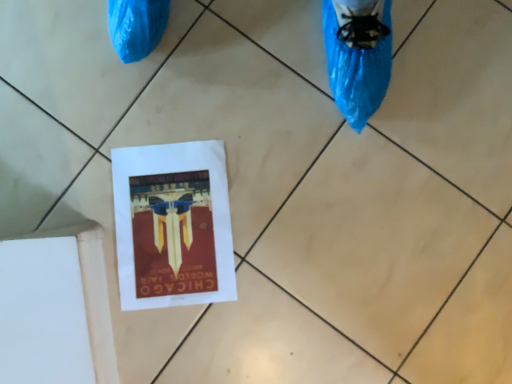
Question: Is white paper at center shorter than matte paper flyer at center?

Choices:
 (A) yes
 (B) no

Answer: (B)

Question: From the image's perspective, does white paper at center appear lower than matte paper flyer at center?

Choices:
 (A) no
 (B) yes

Answer: (B)

Question: From the image's perspective, is white paper at center above matte paper flyer at center?

Choices:
 (A) no
 (B) yes

Answer: (A)

Question: Can you confirm if white paper at center is taller than matte paper flyer at center?

Choices:
 (A) yes
 (B) no

Answer: (A)

Question: Is white paper at center beside matte paper flyer at center?

Choices:
 (A) yes
 (B) no

Answer: (B)

Question: Is white paper at center thinner than matte paper flyer at center?

Choices:
 (A) yes
 (B) no

Answer: (A)

Question: Is white paper at center surrounded by matte paper flyer at center?

Choices:
 (A) yes
 (B) no

Answer: (B)

Question: Does matte paper flyer at center have a lesser height compared to white paper at center?

Choices:
 (A) no
 (B) yes

Answer: (B)

Question: From the image's perspective, is matte paper flyer at center over white paper at center?

Choices:
 (A) no
 (B) yes

Answer: (B)

Question: Does matte paper flyer at center turn towards white paper at center?

Choices:
 (A) no
 (B) yes

Answer: (B)

Question: From the image's perspective, is matte paper flyer at center under white paper at center?

Choices:
 (A) yes
 (B) no

Answer: (B)

Question: Is the surface of matte paper flyer at center in direct contact with white paper at center?

Choices:
 (A) yes
 (B) no

Answer: (B)

Question: Based on their sizes in the image, would you say white paper at center is bigger or smaller than matte paper flyer at center?

Choices:
 (A) big
 (B) small

Answer: (A)